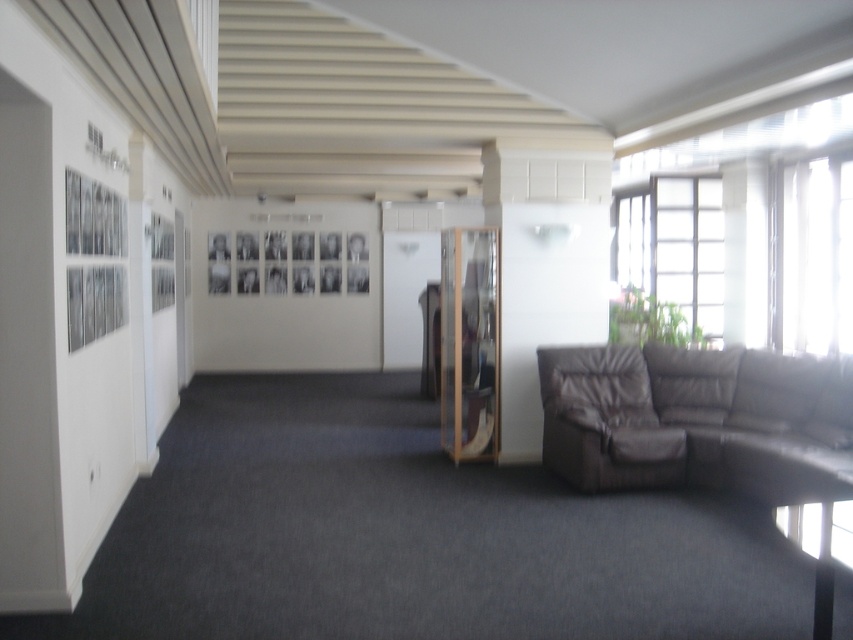
Which is below, brown leather couch at lower right or brown leather armchair at lower right?

brown leather armchair at lower right is below.

Is brown leather couch at lower right taller than brown leather armchair at lower right?

Incorrect, brown leather couch at lower right's height is not larger of brown leather armchair at lower right's.

Is point (846, 440) closer to viewer compared to point (676, 456)?

Yes, point (846, 440) is in front of point (676, 456).

The image size is (853, 640). Identify the location of brown leather couch at lower right. point(698,420).